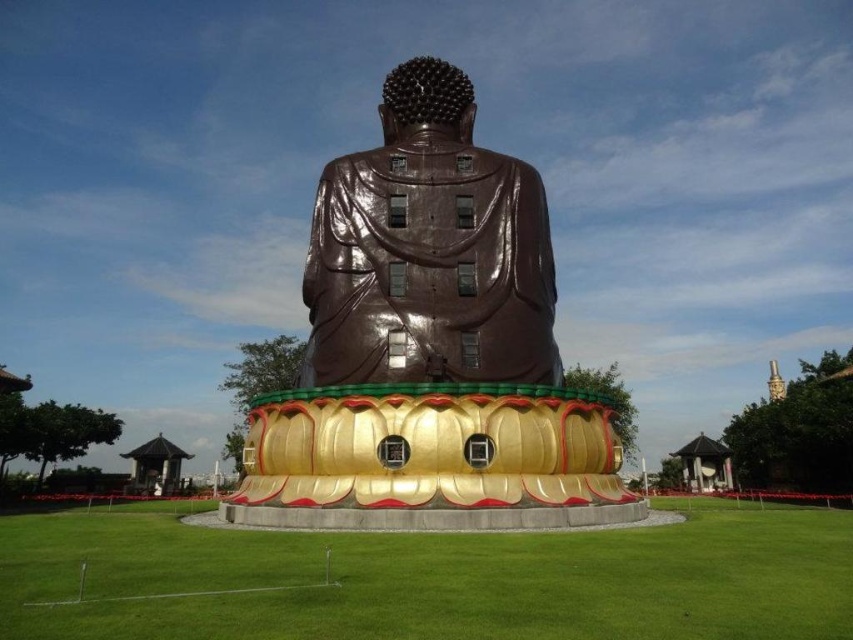
You are standing in the open grassy area and want to take a photo of the bronze statue at center. If you move forward 0.2 units from your current position at point (428, 346), will you be closer to the statue?

The bronze statue at center is located at point (428, 346). Moving forward 0.2 units from that point would bring you closer to the statue.